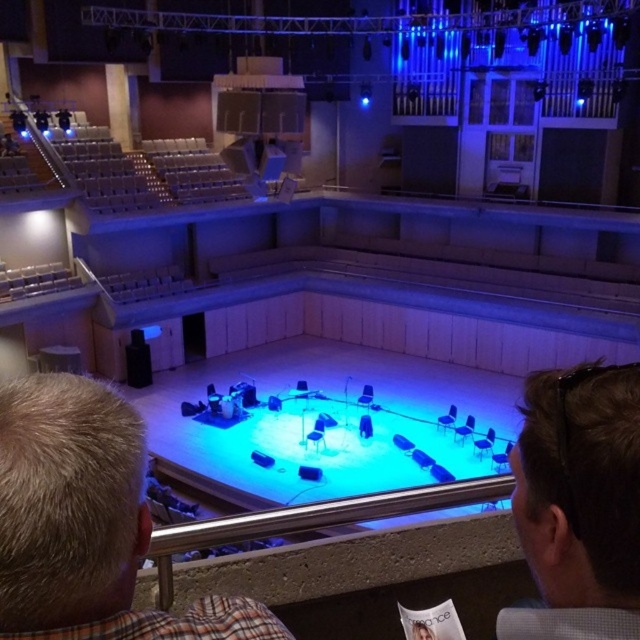
Is blonde hair at center to the right of light brown hair at lower right from the viewer's perspective?

Incorrect, blonde hair at center is not on the right side of light brown hair at lower right.

Between point (275, 624) and point (625, 486), which one is positioned behind?

Point (275, 624)

Measure the distance between blonde hair at center and camera.

They are 59.95 centimeters apart.

What are the coordinates of `blonde hair at center` in the screenshot? It's located at (86, 522).